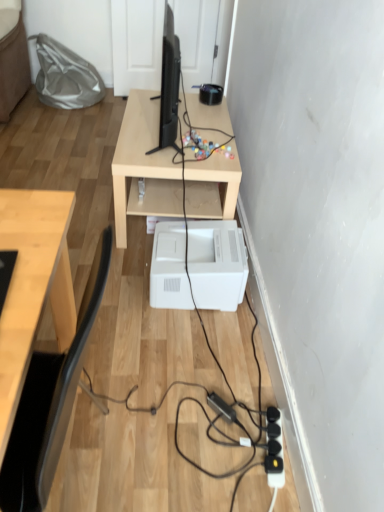
This screenshot has width=384, height=512. I want to click on free space to the left of light wood table at center, so click(x=74, y=166).